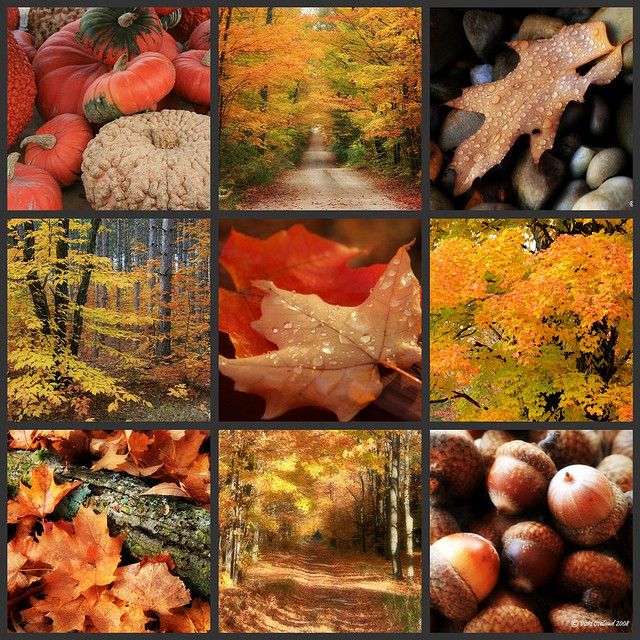
This screenshot has height=640, width=640. Find the location of `picture`. picture is located at coordinates (154, 545), (278, 529), (496, 509), (493, 384), (323, 348), (160, 339), (99, 120), (294, 109), (522, 104).